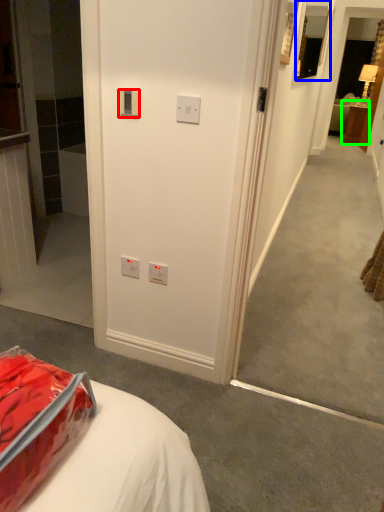
Question: Which is nearer to the electric outlet (highlighted by a red box)? picture frame (highlighted by a blue box) or furniture (highlighted by a green box).

Choices:
 (A) picture frame
 (B) furniture

Answer: (A)